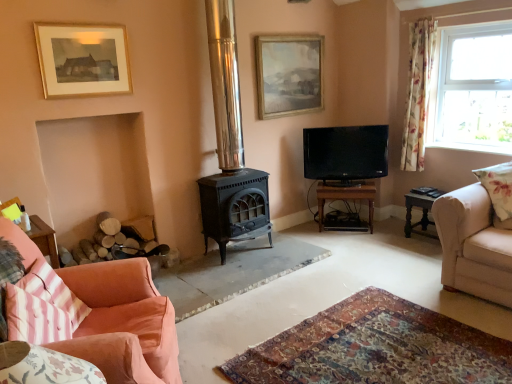
Identify the location of vacant space situated on the left part of beige fabric couch at right, which is the first studio couch from right to left. (397, 271).